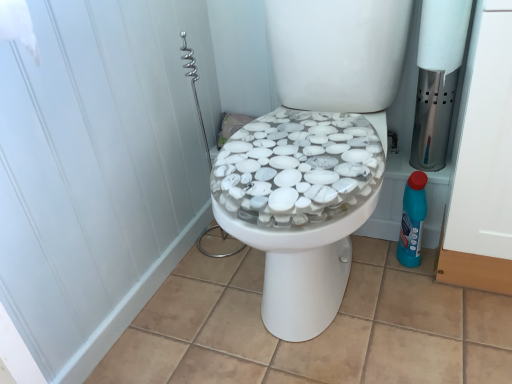
Locate an element on the screen. This screenshot has width=512, height=384. vacant area to the right of white matte screen door at upper left is located at coordinates (337, 296).